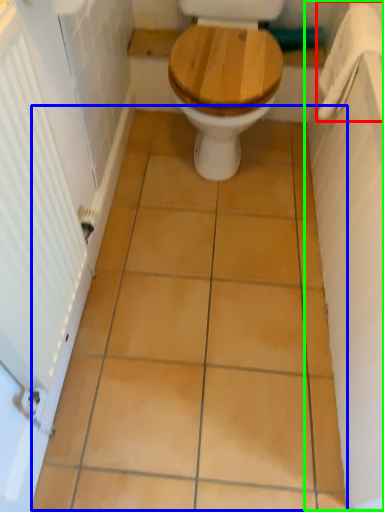
Question: Which object is positioned farthest from towel bar (highlighted by a red box)? Select from ceramic tile (highlighted by a blue box) and bath (highlighted by a green box).

Choices:
 (A) ceramic tile
 (B) bath

Answer: (A)